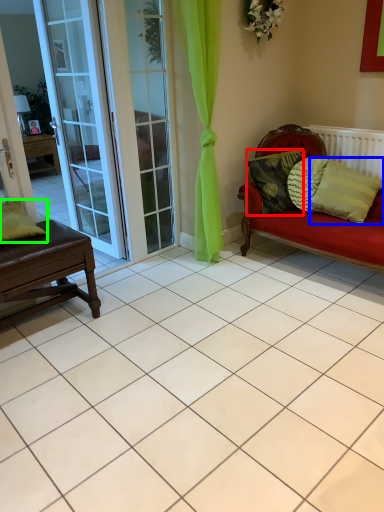
Question: Based on their relative distances, which object is farther from pillow (highlighted by a red box)? Choose from pillow (highlighted by a blue box) and pillow (highlighted by a green box).

Choices:
 (A) pillow
 (B) pillow

Answer: (B)